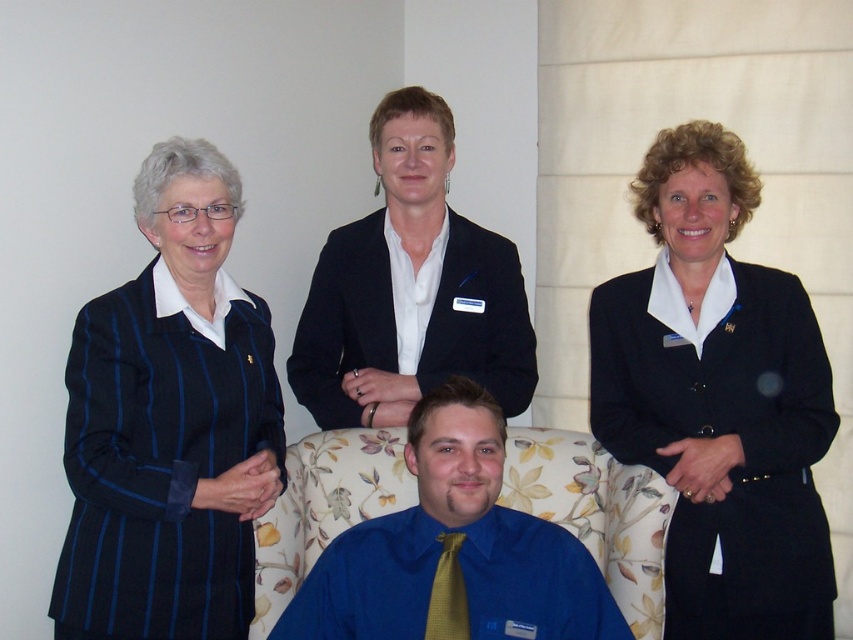
Question: Which point is closer to the camera?

Choices:
 (A) (405, 515)
 (B) (703, 406)
 (C) (451, 632)

Answer: (C)

Question: Which of the following is the farthest from the observer?

Choices:
 (A) (171, 460)
 (B) (506, 289)
 (C) (404, 452)
 (D) (757, 276)

Answer: (B)

Question: Does black matte blazer at center appear on the right side of yellow textured tie at center?

Choices:
 (A) no
 (B) yes

Answer: (A)

Question: Estimate the real-world distances between objects in this image. Which object is closer to the yellow textured tie at center?

Choices:
 (A) black matte blazer at center
 (B) blue satin shirt at center
 (C) black matte blazer at right
 (D) blue striped blazer at left

Answer: (B)

Question: Does blue striped blazer at left appear under yellow textured tie at center?

Choices:
 (A) no
 (B) yes

Answer: (A)

Question: From the image, what is the correct spatial relationship of blue satin shirt at center in relation to yellow textured tie at center?

Choices:
 (A) above
 (B) below

Answer: (A)